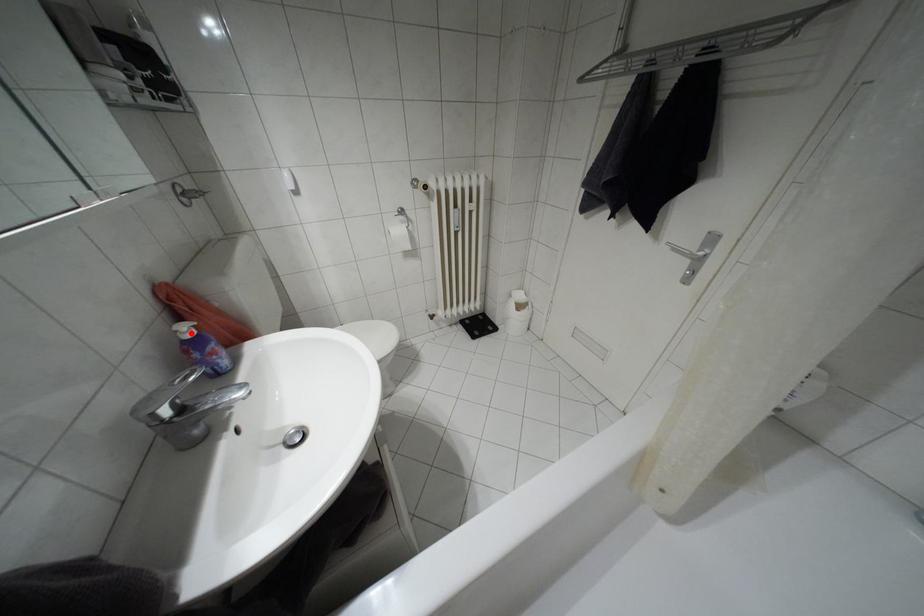
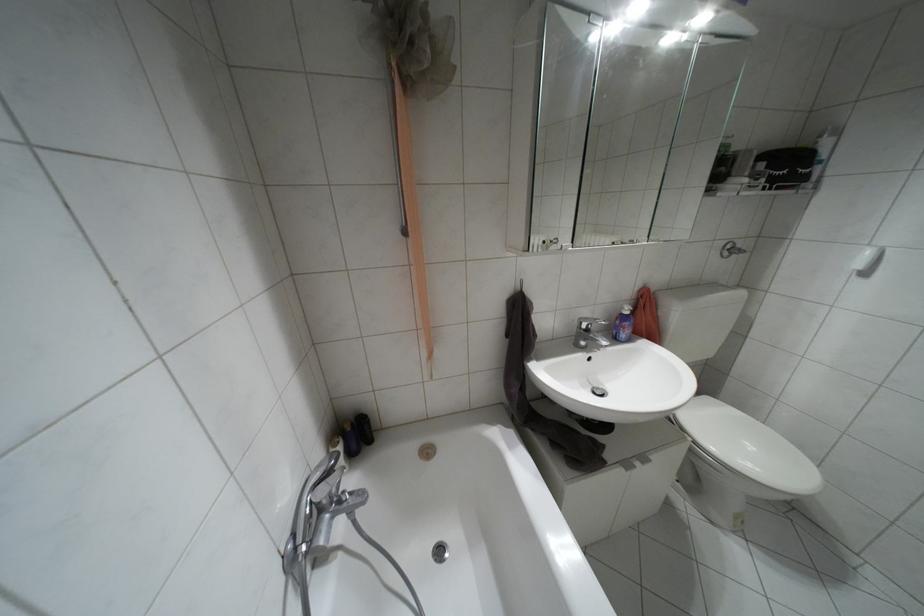
Locate, in the second image, the point that corresponds to the highlighted location in the first image.

(626, 312)